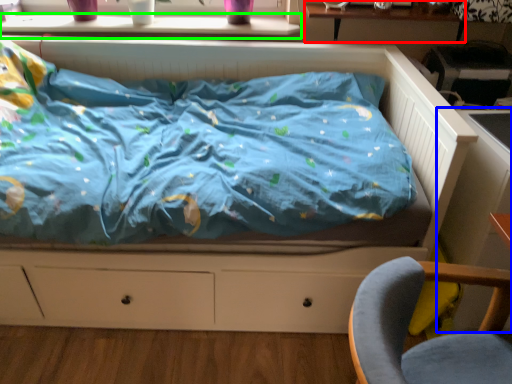
Question: Based on their relative distances, which object is nearer to table (highlighted by a red box)? Choose from table (highlighted by a blue box) and window sill (highlighted by a green box).

Choices:
 (A) table
 (B) window sill

Answer: (B)